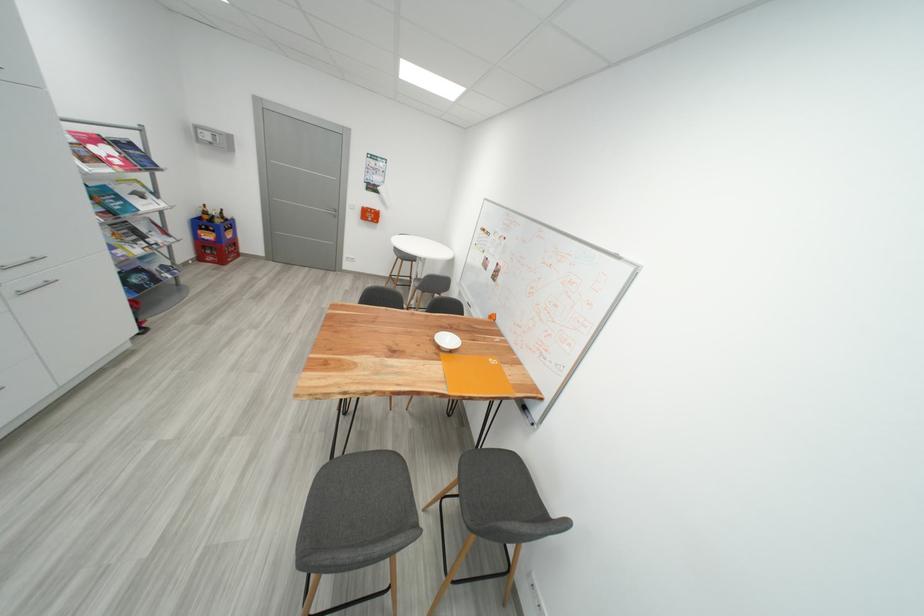
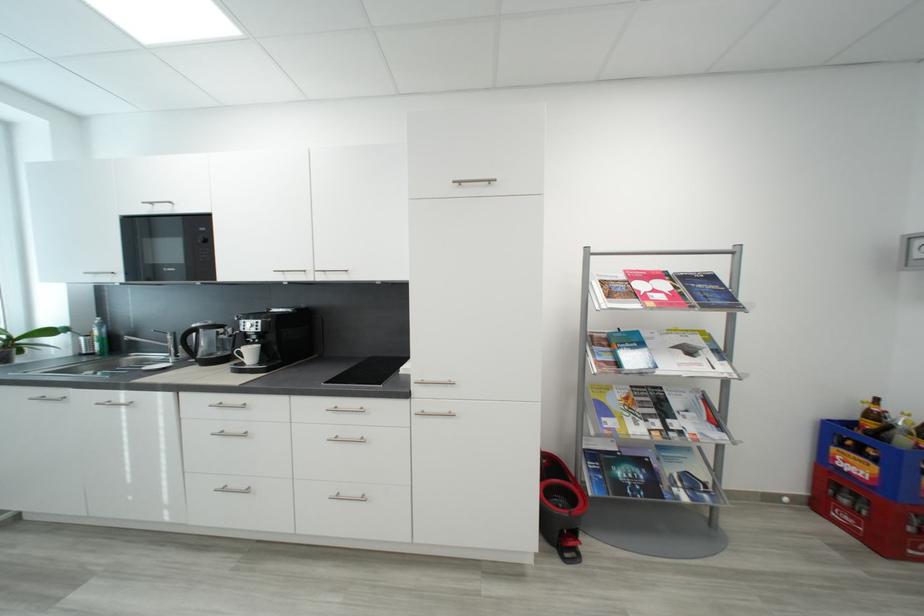
The point at [139,147] is marked in the first image. Where is the corresponding point in the second image?

(718, 280)